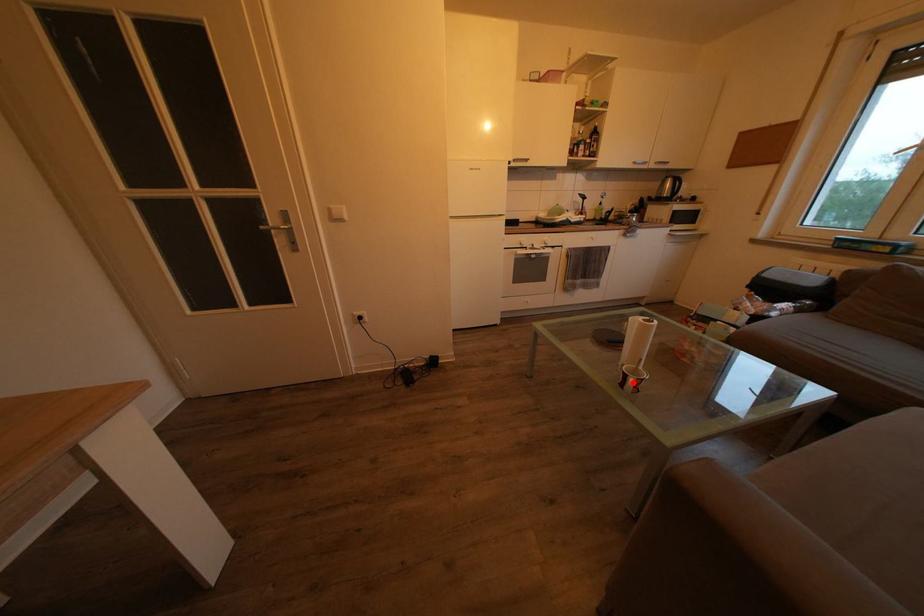
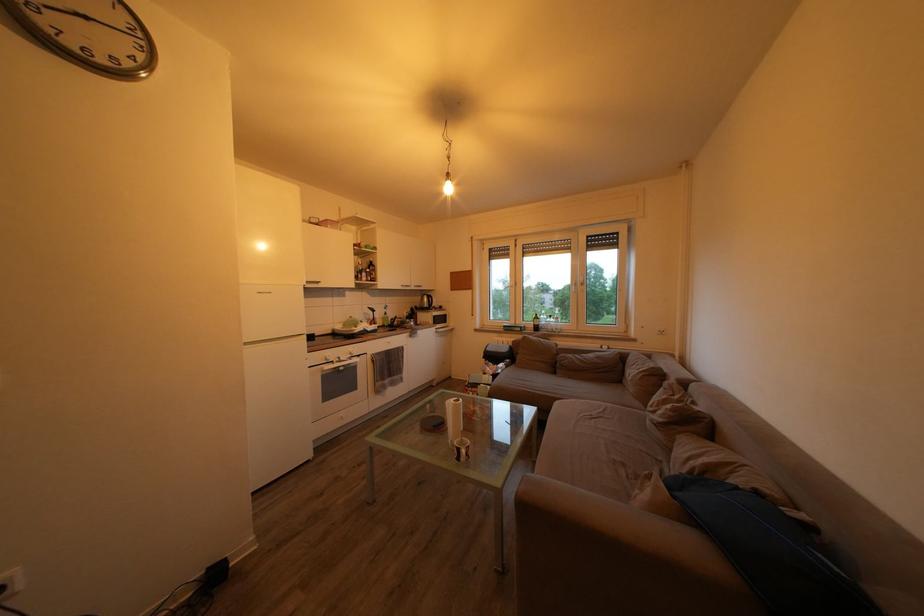
Where in the second image is the point corresponding to the highlighted location from the first image?

(467, 456)